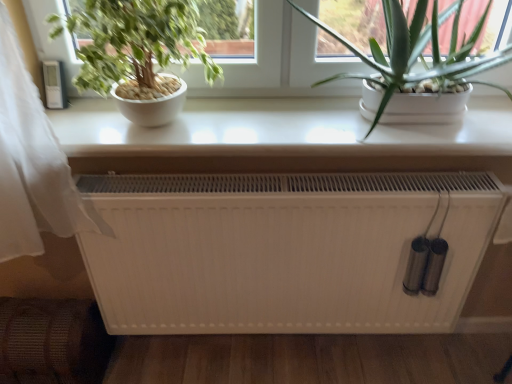
At what (x,y) coordinates should I click in order to perform the action: click on vacant space underneath green leafy plant at upper right, acting as the first houseplant starting from the right (from a real-world perspective). Please return your answer as a coordinate pair (x, y). Looking at the image, I should click on (405, 131).